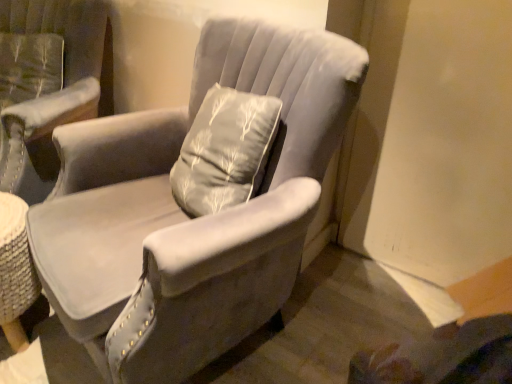
Question: Should I look upward or downward to see velvet gray armchair at center, arranged as the 2th chair when viewed from the left?

Choices:
 (A) down
 (B) up

Answer: (A)

Question: Is velvet gray armchair at upper left, the 2th chair from the right, bigger than velvet gray armchair at center, arranged as the 2th chair when viewed from the left?

Choices:
 (A) yes
 (B) no

Answer: (B)

Question: Is velvet gray armchair at upper left, the first chair from the left, placed right next to velvet gray armchair at center, positioned as the 1th chair in right-to-left order?

Choices:
 (A) no
 (B) yes

Answer: (A)

Question: Is velvet gray armchair at upper left, the 2th chair from the right, facing away from velvet gray armchair at center, arranged as the 2th chair when viewed from the left?

Choices:
 (A) yes
 (B) no

Answer: (B)

Question: Is velvet gray armchair at upper left, the first chair from the left, not inside velvet gray armchair at center, positioned as the 1th chair in right-to-left order?

Choices:
 (A) yes
 (B) no

Answer: (A)

Question: Is velvet gray armchair at center, positioned as the 1th chair in right-to-left order, inside velvet gray armchair at upper left, the first chair from the left?

Choices:
 (A) no
 (B) yes

Answer: (A)

Question: From the image's perspective, is velvet gray armchair at upper left, the first chair from the left, over velvet gray armchair at center, positioned as the 1th chair in right-to-left order?

Choices:
 (A) yes
 (B) no

Answer: (A)

Question: Are velvet gray armchair at center, positioned as the 1th chair in right-to-left order, and velvet gray armchair at upper left, the first chair from the left, far apart?

Choices:
 (A) yes
 (B) no

Answer: (B)

Question: From the image's perspective, would you say velvet gray armchair at center, positioned as the 1th chair in right-to-left order, is shown under velvet gray armchair at upper left, the 2th chair from the right?

Choices:
 (A) no
 (B) yes

Answer: (B)

Question: Is velvet gray armchair at center, arranged as the 2th chair when viewed from the left, thinner than velvet gray armchair at upper left, the first chair from the left?

Choices:
 (A) no
 (B) yes

Answer: (A)

Question: Is velvet gray armchair at center, arranged as the 2th chair when viewed from the left, taller than velvet gray armchair at upper left, the first chair from the left?

Choices:
 (A) yes
 (B) no

Answer: (A)

Question: Is velvet gray armchair at center, positioned as the 1th chair in right-to-left order, looking in the opposite direction of velvet gray armchair at upper left, the first chair from the left?

Choices:
 (A) no
 (B) yes

Answer: (A)

Question: Considering the relative sizes of velvet gray armchair at center, positioned as the 1th chair in right-to-left order, and velvet gray armchair at upper left, the first chair from the left, in the image provided, is velvet gray armchair at center, positioned as the 1th chair in right-to-left order, bigger than velvet gray armchair at upper left, the first chair from the left,?

Choices:
 (A) yes
 (B) no

Answer: (A)

Question: In the image, is velvet gray armchair at center, positioned as the 1th chair in right-to-left order, on the left side or the right side of velvet gray armchair at upper left, the 2th chair from the right?

Choices:
 (A) right
 (B) left

Answer: (A)